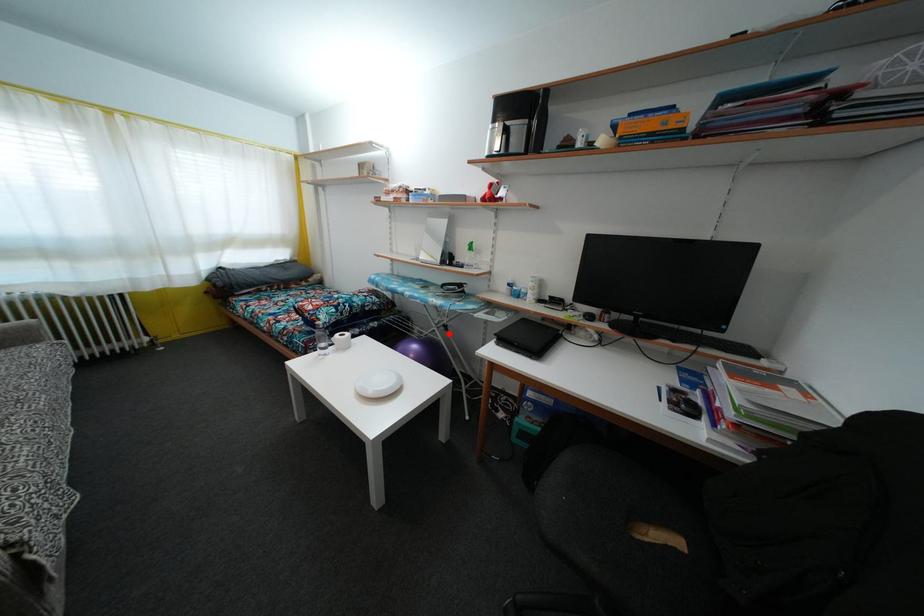
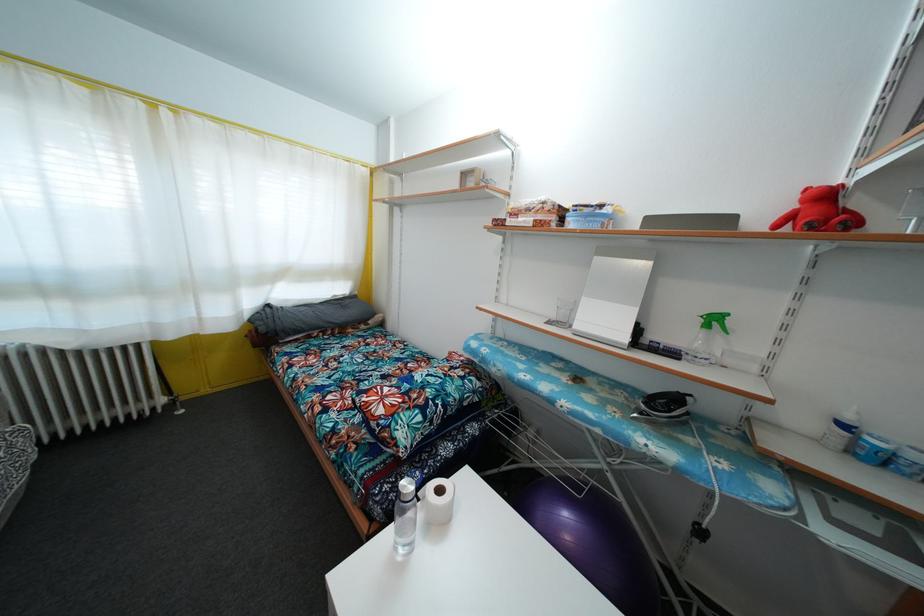
Find the pixel in the second image that matches the highlighted location in the first image.

(704, 540)